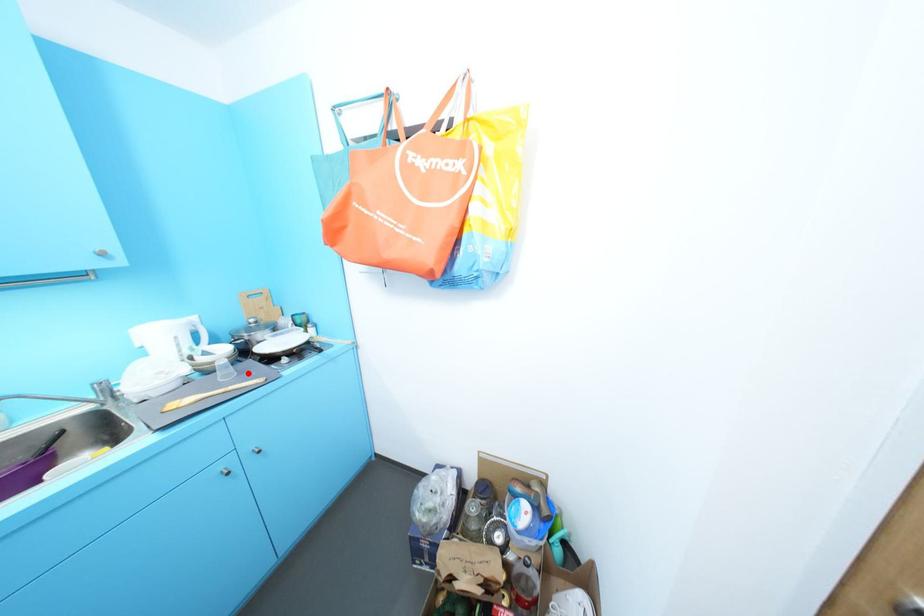
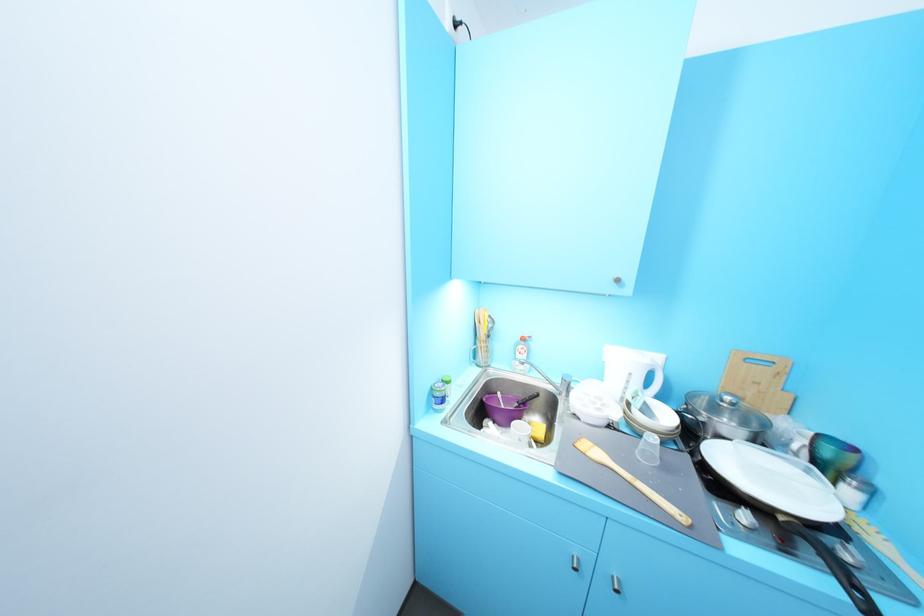
The point at the highlighted location is marked in the first image. Where is the corresponding point in the second image?

(673, 468)